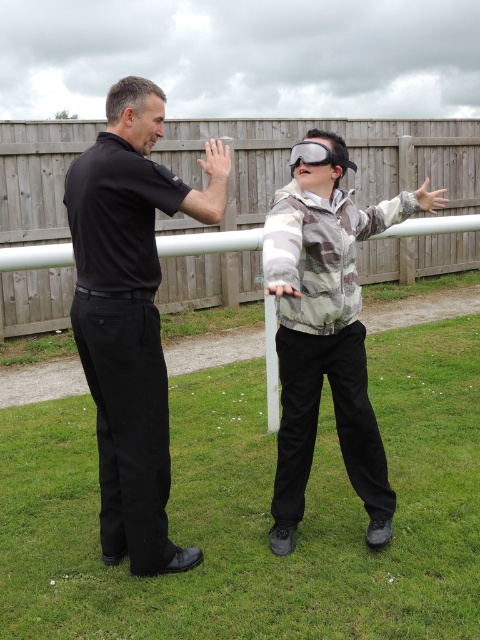
Question: Can you confirm if white plastic rail at center is wider than satin black goggles at upper center?

Choices:
 (A) no
 (B) yes

Answer: (B)

Question: Which is nearer to the black smooth shirt at left?

Choices:
 (A) white plastic rail at center
 (B) satin black goggles at upper center
 (C) wooden fence at center
 (D) camouflage jacket at center

Answer: (D)

Question: Which of the following is the farthest from the observer?

Choices:
 (A) (47, 150)
 (B) (337, 250)

Answer: (A)

Question: Which object is the closest to the white plastic rail at center?

Choices:
 (A) satin black goggles at upper center
 (B) black smooth shirt at left

Answer: (A)

Question: Does camouflage jacket at center appear under white plastic rail at center?

Choices:
 (A) yes
 (B) no

Answer: (A)

Question: Is black smooth shirt at left positioned behind satin black goggles at upper center?

Choices:
 (A) no
 (B) yes

Answer: (A)